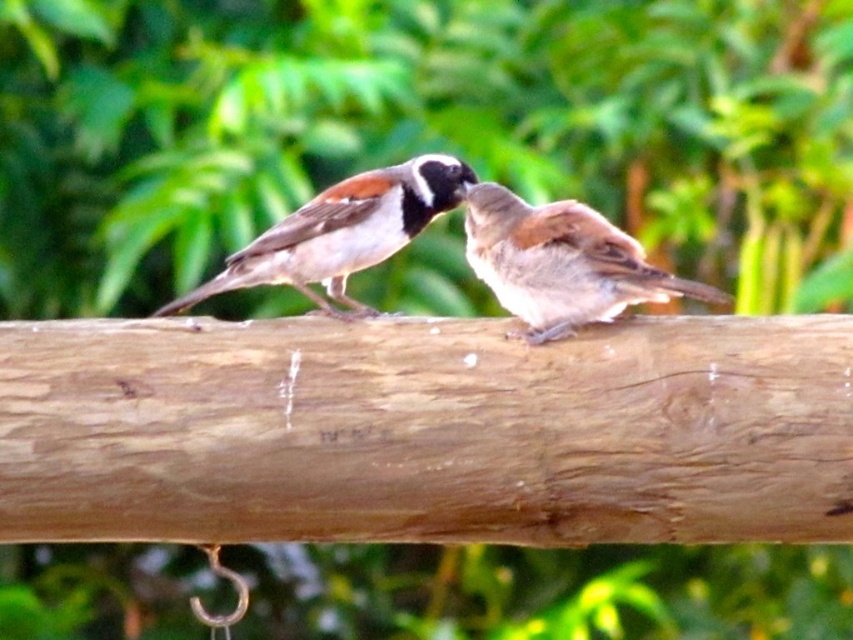
Is brown wood log at center to the left of brown speckled feathers at center from the viewer's perspective?

In fact, brown wood log at center is to the right of brown speckled feathers at center.

Locate an element on the screen. This screenshot has width=853, height=640. brown wood log at center is located at coordinates (426, 432).

This screenshot has width=853, height=640. I want to click on brown wood log at center, so click(426, 432).

Between brown wood log at center and brown feathered sparrow at center, which one appears on the right side from the viewer's perspective?

brown feathered sparrow at center is more to the right.

Can you confirm if brown wood log at center is positioned to the left of brown feathered sparrow at center?

Yes, brown wood log at center is to the left of brown feathered sparrow at center.

Which is behind, point (374, 349) or point (567, 317)?

Point (567, 317)

I want to click on brown wood log at center, so click(x=426, y=432).

Is brown feathered sparrow at center smaller than brown speckled feathers at center?

No, brown feathered sparrow at center is not smaller than brown speckled feathers at center.

Between brown feathered sparrow at center and brown speckled feathers at center, which one is positioned lower?

Positioned lower is brown feathered sparrow at center.

Where is `brown feathered sparrow at center`? Image resolution: width=853 pixels, height=640 pixels. brown feathered sparrow at center is located at coordinates (561, 262).